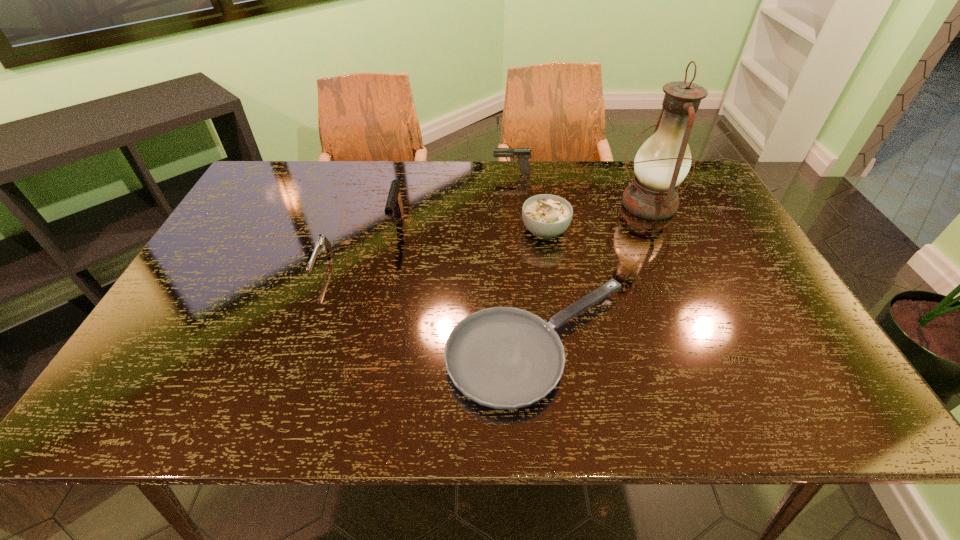
Locate an element on the screen. oil lamp is located at coordinates (663, 161).

The height and width of the screenshot is (540, 960). What are the coordinates of `the tallest object` in the screenshot? It's located at (663, 161).

Locate an element on the screen. the second object from left to right is located at coordinates click(x=394, y=205).

Find the location of a particular element. The width and height of the screenshot is (960, 540). the tallest pistol is located at coordinates (394, 205).

Find the location of a particular element. This screenshot has width=960, height=540. the farthest pistol is located at coordinates (523, 154).

The height and width of the screenshot is (540, 960). What are the coordinates of `the rightmost pistol` in the screenshot? It's located at (523, 154).

Where is `soup bowl`? soup bowl is located at coordinates (546, 216).

Identify the location of the shortest pistol. pyautogui.click(x=322, y=242).

This screenshot has height=540, width=960. I want to click on the leftmost object, so click(x=322, y=242).

I want to click on the shortest object, so click(x=502, y=357).